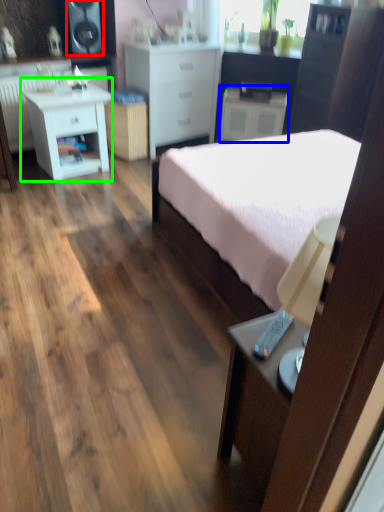
Question: Considering the real-world distances, which object is closest to speaker (highlighted by a red box)? nightstand (highlighted by a blue box) or nightstand (highlighted by a green box).

Choices:
 (A) nightstand
 (B) nightstand

Answer: (B)